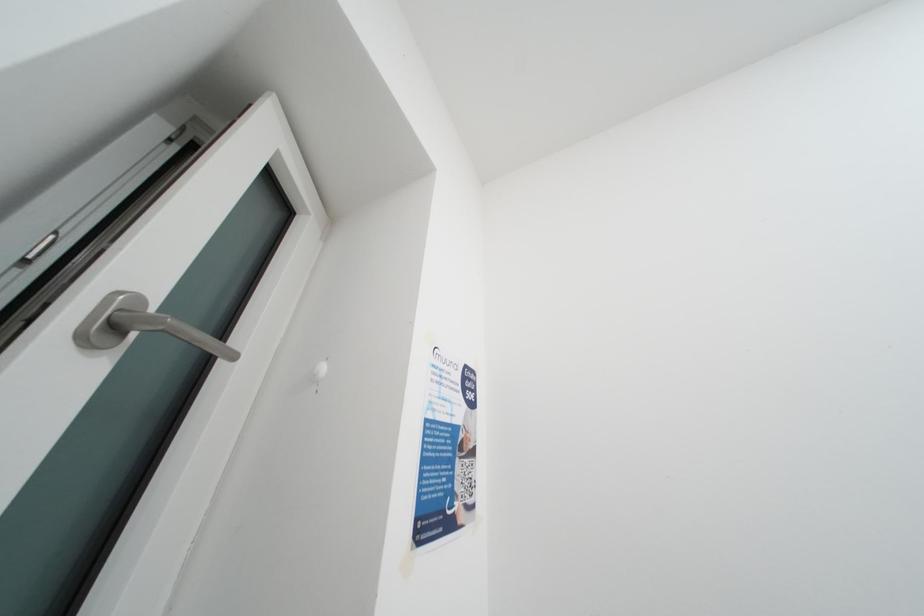
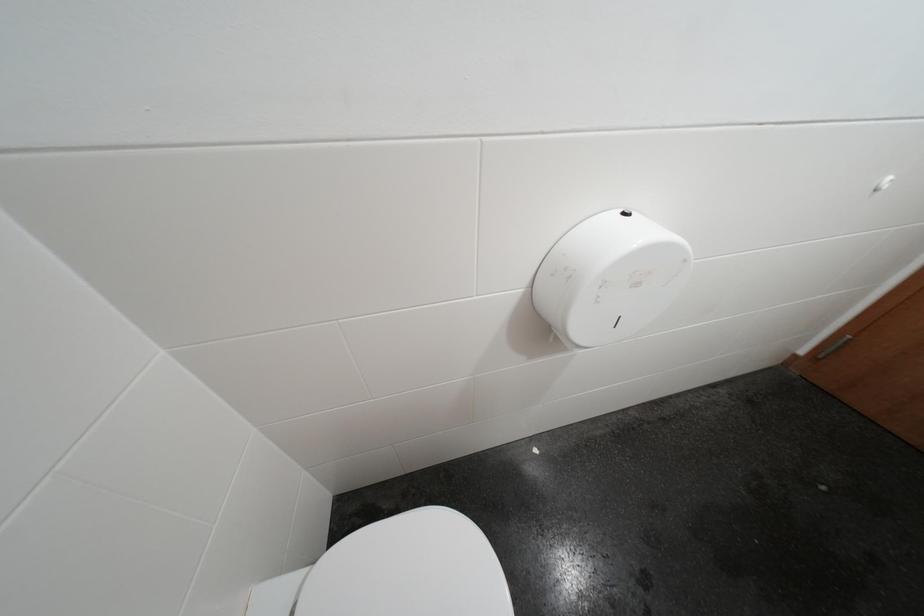
First-person continuous shooting, in which direction is the camera rotating?

The rotation direction of the camera is right-down.